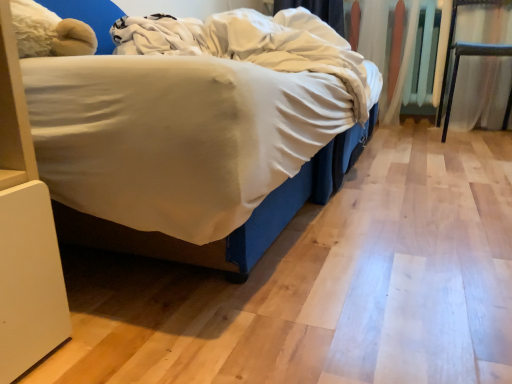
In order to click on free space below metallic silver chair at right (from a real-world perspective) in this screenshot , I will do `click(477, 137)`.